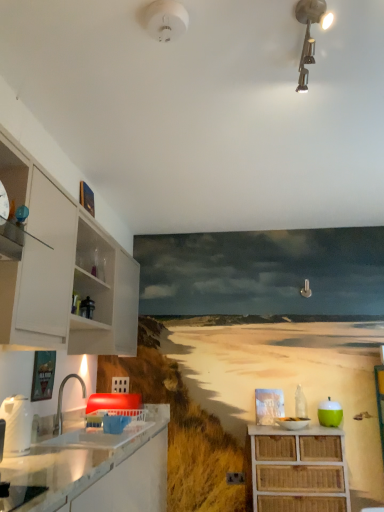
Question: Is green matte apple at right, the first appliance from the back, positioned with its back to white glossy kettle at left, marked as the 1th appliance in a top-to-bottom arrangement?

Choices:
 (A) no
 (B) yes

Answer: (A)

Question: From a real-world perspective, is green matte apple at right, which is the 2th appliance in front-to-back order, located beneath white glossy kettle at left, which is counted as the 1th appliance, starting from the left?

Choices:
 (A) no
 (B) yes

Answer: (B)

Question: From a real-world perspective, is green matte apple at right, which is the 2th appliance in front-to-back order, physically above white glossy kettle at left, the 2th appliance in the right-to-left sequence?

Choices:
 (A) no
 (B) yes

Answer: (A)

Question: From the image's perspective, is green matte apple at right, the first appliance from the back, beneath white glossy kettle at left, which ranks as the first appliance in front-to-back order?

Choices:
 (A) no
 (B) yes

Answer: (B)

Question: Is green matte apple at right, which is the 2th appliance in front-to-back order, at the left side of white glossy kettle at left, which is counted as the 1th appliance, starting from the left?

Choices:
 (A) no
 (B) yes

Answer: (A)

Question: Considering the relative sizes of green matte apple at right, the first appliance positioned from the right, and white glossy kettle at left, the second appliance from the bottom, in the image provided, is green matte apple at right, the first appliance positioned from the right, bigger than white glossy kettle at left, the second appliance from the bottom,?

Choices:
 (A) yes
 (B) no

Answer: (B)

Question: From the image's perspective, is white glossy sink at lower left located beneath white glossy countertop at lower left?

Choices:
 (A) yes
 (B) no

Answer: (B)

Question: Can you confirm if white glossy sink at lower left is bigger than white glossy countertop at lower left?

Choices:
 (A) no
 (B) yes

Answer: (A)

Question: Is white glossy sink at lower left further to camera compared to white glossy countertop at lower left?

Choices:
 (A) no
 (B) yes

Answer: (B)

Question: Considering the relative sizes of white glossy sink at lower left and white glossy countertop at lower left in the image provided, is white glossy sink at lower left smaller than white glossy countertop at lower left?

Choices:
 (A) no
 (B) yes

Answer: (B)

Question: Is white glossy sink at lower left at the left side of white glossy countertop at lower left?

Choices:
 (A) no
 (B) yes

Answer: (A)

Question: Is white glossy sink at lower left positioned with its back to white glossy countertop at lower left?

Choices:
 (A) no
 (B) yes

Answer: (A)

Question: From the image's perspective, is white glossy cabinet at left, which is the first cabinetry in top-to-bottom order, above metallic track lighting at upper center, which appears as the 1th light fixture when viewed from the right?

Choices:
 (A) yes
 (B) no

Answer: (B)